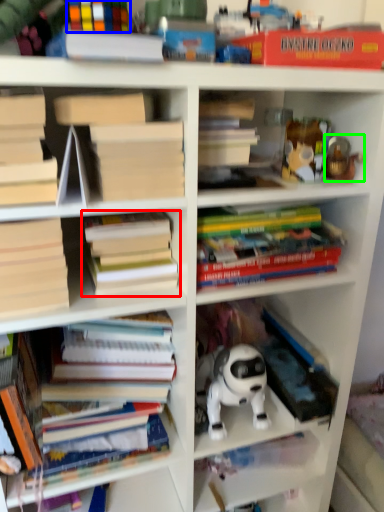
Question: Estimate the real-world distances between objects in this image. Which object is closer to book (highlighted by a red box), book (highlighted by a blue box) or toy (highlighted by a green box)?

Choices:
 (A) book
 (B) toy

Answer: (A)